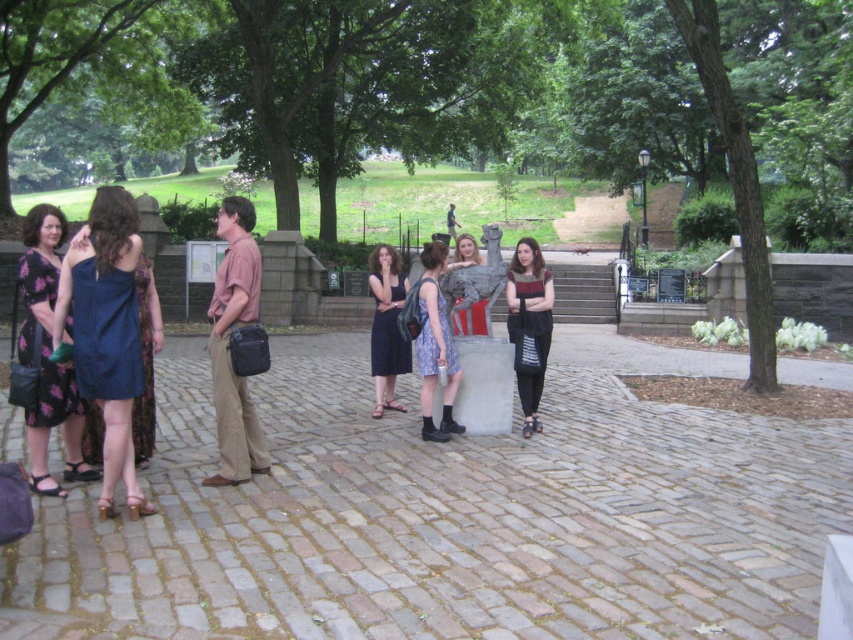
You are a photographer trying to capture a shot of both the printed cotton dress at center and the matte black dress at center. Since you want them both in the frame, which dress should you position closer to the camera to ensure the other is visible?

To include both dresses in the frame, position the matte black dress at center closer to the camera since the printed cotton dress at center is to the right of it, allowing both to be captured within the shot.

You are organizing a photo shoot and need to ensure that the two dresses are visible in the frame. Given that the floral print dress at left and the matte black dress at center are part of the setup, which dress requires a wider shot to capture its full width?

The floral print dress at left requires a wider shot to capture its full width because its width is larger than the matte black dress at center.